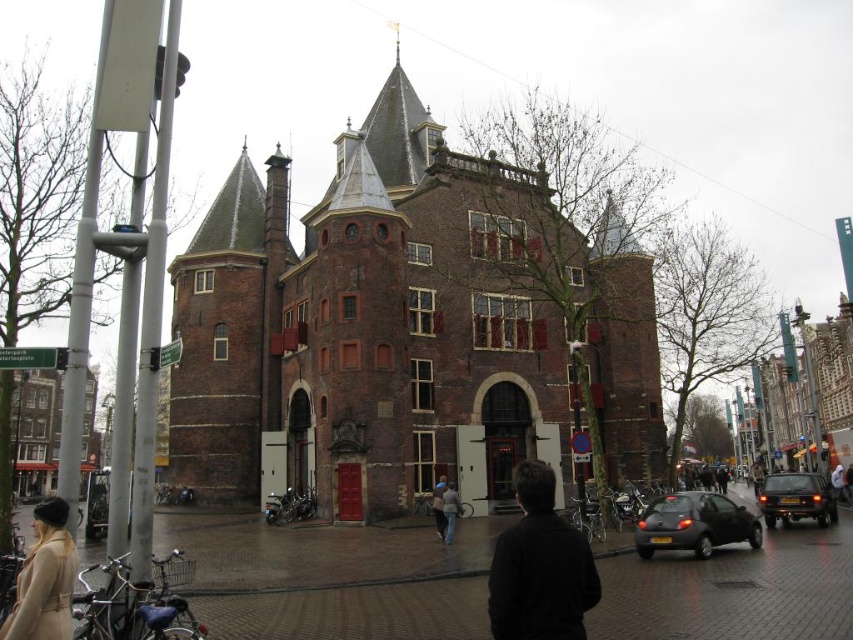
You are a fashion designer observing the historic brick building scene. You notice a black leather jacket at center and a white hoodie at center. Which clothing item is positioned higher in the image?

The black leather jacket at center is positioned higher than the white hoodie at center in the image.